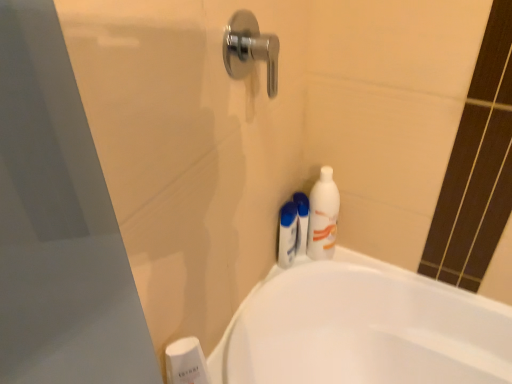
What do you see at coordinates (362, 329) in the screenshot?
I see `white glossy bathtub at lower right` at bounding box center [362, 329].

Find the location of a particular element. The width and height of the screenshot is (512, 384). white plastic soap dispenser at lower left, arranged as the 1th toiletry when viewed from the front is located at coordinates (186, 362).

Find the location of a particular element. The image size is (512, 384). white matte bottle at right is located at coordinates (323, 216).

Image resolution: width=512 pixels, height=384 pixels. In order to click on white matte shaving cream at upper right in this screenshot , I will do `click(302, 221)`.

Can you confirm if chrome metallic door handle at upper center is taller than white matte shaving cream at upper right?

In fact, chrome metallic door handle at upper center may be shorter than white matte shaving cream at upper right.

Based on the photo, which object is further away from the camera, chrome metallic door handle at upper center or white matte shaving cream at upper right?

white matte shaving cream at upper right.

From a real-world perspective, does chrome metallic door handle at upper center stand above white matte shaving cream at upper right?

Yes, from a real-world perspective, chrome metallic door handle at upper center is above white matte shaving cream at upper right.

Which object is closer to the camera, white matte shaving cream at upper right or white plastic soap dispenser at lower left, the second toiletry in the right-to-left sequence?

white plastic soap dispenser at lower left, the second toiletry in the right-to-left sequence, is in front.

Which object is thinner, white matte shaving cream at upper right or white plastic soap dispenser at lower left, arranged as the second toiletry when viewed from the top?

With smaller width is white plastic soap dispenser at lower left, arranged as the second toiletry when viewed from the top.

From the white matte shaving cream at upper right, count the 2nd toiletry to the left and point to it. Please provide its 2D coordinates.

[(186, 362)]

Which is correct: white matte shaving cream at upper right is inside white plastic soap dispenser at lower left, placed as the second toiletry when sorted from back to front, or outside of it?

white matte shaving cream at upper right is located beyond the bounds of white plastic soap dispenser at lower left, placed as the second toiletry when sorted from back to front.

Based on their positions, is white plastic shampoo bottle at upper center, which is the second toiletry from left to right, located to the left or right of white glossy bathtub at lower right?

Based on their positions, white plastic shampoo bottle at upper center, which is the second toiletry from left to right, is located to the left of white glossy bathtub at lower right.

Which point is more forward, (283, 227) or (285, 346)?

The point (283, 227) is more forward.

Considering the sizes of objects white plastic shampoo bottle at upper center, which is the second toiletry from left to right, and white glossy bathtub at lower right in the image provided, who is wider, white plastic shampoo bottle at upper center, which is the second toiletry from left to right, or white glossy bathtub at lower right?

white glossy bathtub at lower right.

Is white plastic shampoo bottle at upper center, which is the second toiletry from left to right, far away from white plastic soap dispenser at lower left, arranged as the 1th toiletry when viewed from the front?

No.

How far apart are white plastic shampoo bottle at upper center, the first toiletry when ordered from back to front, and white plastic soap dispenser at lower left, placed as the second toiletry when sorted from back to front?

white plastic shampoo bottle at upper center, the first toiletry when ordered from back to front, is 16.28 inches away from white plastic soap dispenser at lower left, placed as the second toiletry when sorted from back to front.

Considering the relative positions of white plastic shampoo bottle at upper center, acting as the first toiletry starting from the top, and white plastic soap dispenser at lower left, placed as the second toiletry when sorted from back to front, in the image provided, is white plastic shampoo bottle at upper center, acting as the first toiletry starting from the top, to the left or to the right of white plastic soap dispenser at lower left, placed as the second toiletry when sorted from back to front,?

white plastic shampoo bottle at upper center, acting as the first toiletry starting from the top, is positioned on white plastic soap dispenser at lower left, placed as the second toiletry when sorted from back to front,'s right side.

From the image's perspective, between white plastic shampoo bottle at upper center, acting as the first toiletry starting from the top, and white plastic soap dispenser at lower left, arranged as the 1th toiletry when viewed from the front, who is located below?

From the image's view, white plastic soap dispenser at lower left, arranged as the 1th toiletry when viewed from the front, is below.

Is white glossy bathtub at lower right located outside white matte shaving cream at upper right?

Yes, white glossy bathtub at lower right is not within white matte shaving cream at upper right.

Who is shorter, white glossy bathtub at lower right or white matte shaving cream at upper right?

With less height is white matte shaving cream at upper right.

From the image's perspective, would you say white glossy bathtub at lower right is shown under white matte shaving cream at upper right?

Correct, white glossy bathtub at lower right appears lower than white matte shaving cream at upper right in the image.

How different are the orientations of white glossy bathtub at lower right and white matte bottle at right in degrees?

The angular difference between white glossy bathtub at lower right and white matte bottle at right is 90.5 degrees.

Which of these two, white glossy bathtub at lower right or white matte bottle at right, stands taller?

With more height is white glossy bathtub at lower right.

Is white matte bottle at right completely or partially inside white glossy bathtub at lower right?

No, white glossy bathtub at lower right does not contain white matte bottle at right.

This screenshot has width=512, height=384. I want to click on bathtub on the right of white matte bottle at right, so click(362, 329).

Considering the sizes of objects white glossy bathtub at lower right and chrome metallic door handle at upper center in the image provided, who is wider, white glossy bathtub at lower right or chrome metallic door handle at upper center?

white glossy bathtub at lower right is wider.

Is white glossy bathtub at lower right far from chrome metallic door handle at upper center?

No, white glossy bathtub at lower right is not far from chrome metallic door handle at upper center.

Which object is further away from the camera, white glossy bathtub at lower right or chrome metallic door handle at upper center?

white glossy bathtub at lower right.

In terms of height, does white glossy bathtub at lower right look taller or shorter compared to chrome metallic door handle at upper center?

Clearly, white glossy bathtub at lower right is taller compared to chrome metallic door handle at upper center.

This screenshot has width=512, height=384. I want to click on door handle in front of the white matte shaving cream at upper right, so click(250, 49).

In order to click on shaving cream above the white plastic soap dispenser at lower left, the first toiletry positioned from the left (from the image's perspective) in this screenshot , I will do `click(302, 221)`.

Based on the photo, considering their positions, is white matte shaving cream at upper right positioned closer to white plastic shampoo bottle at upper center, marked as the 2th toiletry in a front-to-back arrangement, than white glossy bathtub at lower right?

Among the two, white matte shaving cream at upper right is located nearer to white plastic shampoo bottle at upper center, marked as the 2th toiletry in a front-to-back arrangement.

From the picture: Based on their spatial positions, is white glossy bathtub at lower right or chrome metallic door handle at upper center further from white plastic shampoo bottle at upper center, marked as the 2th toiletry in a front-to-back arrangement?

chrome metallic door handle at upper center lies further to white plastic shampoo bottle at upper center, marked as the 2th toiletry in a front-to-back arrangement, than the other object.

Based on their spatial positions, is white matte shaving cream at upper right or white glossy bathtub at lower right further from chrome metallic door handle at upper center?

Based on the image, white glossy bathtub at lower right appears to be further to chrome metallic door handle at upper center.

Estimate the real-world distances between objects in this image. Which object is closer to white glossy bathtub at lower right, chrome metallic door handle at upper center or white matte bottle at right?

white matte bottle at right is closer to white glossy bathtub at lower right.

Estimate the real-world distances between objects in this image. Which object is closer to white matte bottle at right, white plastic soap dispenser at lower left, which ranks as the 1th toiletry in bottom-to-top order, or white glossy bathtub at lower right?

white glossy bathtub at lower right.

Based on their spatial positions, is white matte bottle at right or white plastic shampoo bottle at upper center, which is the first toiletry from right to left, closer to white matte shaving cream at upper right?

Based on the image, white plastic shampoo bottle at upper center, which is the first toiletry from right to left, appears to be nearer to white matte shaving cream at upper right.

From the image, which object appears to be nearer to white matte bottle at right, chrome metallic door handle at upper center or white matte shaving cream at upper right?

Based on the image, white matte shaving cream at upper right appears to be nearer to white matte bottle at right.

Which object lies nearer to the anchor point white glossy bathtub at lower right, white plastic soap dispenser at lower left, placed as the second toiletry when sorted from back to front, or white plastic shampoo bottle at upper center, marked as the 2th toiletry in a front-to-back arrangement?

The object closer to white glossy bathtub at lower right is white plastic shampoo bottle at upper center, marked as the 2th toiletry in a front-to-back arrangement.

You are a GUI agent. You are given a task and a screenshot of the screen. Output one action in this format:
    pyautogui.click(x=<x>, y=<y>)
    Task: Click on the toiletry between chrome metallic door handle at upper center and white plastic soap dispenser at lower left, arranged as the second toiletry when viewed from the top, in the up-down direction
    This screenshot has width=512, height=384.
    Given the screenshot: What is the action you would take?
    pyautogui.click(x=288, y=234)

Locate an element on the screen. Image resolution: width=512 pixels, height=384 pixels. shaving cream located between white plastic shampoo bottle at upper center, which is the first toiletry from right to left, and white matte bottle at right in the left-right direction is located at coordinates (302, 221).

Locate an element on the screen. shaving cream between white matte bottle at right and white glossy bathtub at lower right from top to bottom is located at coordinates (302, 221).

Image resolution: width=512 pixels, height=384 pixels. Identify the location of shaving cream that lies between chrome metallic door handle at upper center and white glossy bathtub at lower right from top to bottom. (302, 221).